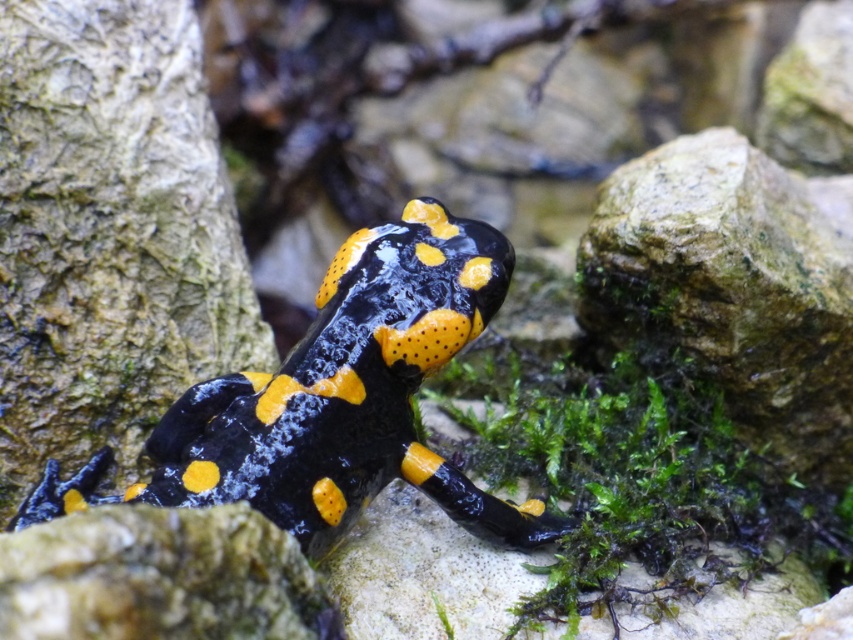
Can you confirm if green mossy rock at center right is thinner than smooth rock at lower center?

No, green mossy rock at center right is not thinner than smooth rock at lower center.

Which is behind, point (660, 220) or point (109, 545)?

The point (660, 220) is more distant.

Where is `green mossy rock at center right`? green mossy rock at center right is located at coordinates (734, 285).

Is black matte salamander at center positioned at the back of green mossy rock at center right?

No, it is not.

Can you confirm if black matte salamander at center is thinner than green mossy rock at center right?

In fact, black matte salamander at center might be wider than green mossy rock at center right.

The height and width of the screenshot is (640, 853). Describe the element at coordinates (351, 394) in the screenshot. I see `black matte salamander at center` at that location.

Where is `black matte salamander at center`? The image size is (853, 640). black matte salamander at center is located at coordinates (351, 394).

Is black matte salamander at center positioned in front of smooth rock at lower center?

That is False.

Can you confirm if black matte salamander at center is positioned to the left of smooth rock at lower center?

Yes, black matte salamander at center is to the left of smooth rock at lower center.

Does point (473, 272) come in front of point (169, 618)?

That is False.

You are a GUI agent. You are given a task and a screenshot of the screen. Output one action in this format:
    pyautogui.click(x=<x>, y=<y>)
    Task: Click on the black matte salamander at center
    This screenshot has width=853, height=640.
    Given the screenshot: What is the action you would take?
    pyautogui.click(x=351, y=394)